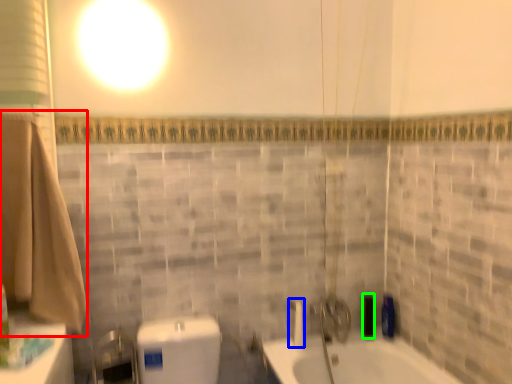
Question: Which object is positioned closest to bath towel (highlighted by a red box)? Select from shower (highlighted by a blue box) and toiletry (highlighted by a green box).

Choices:
 (A) shower
 (B) toiletry

Answer: (A)